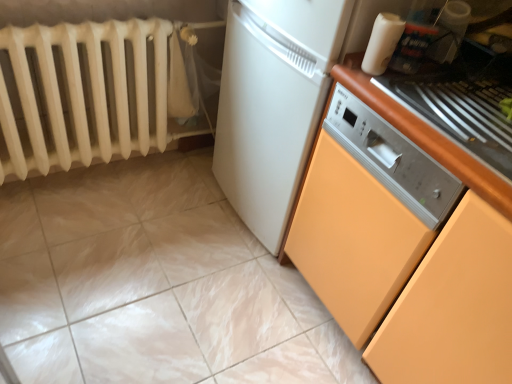
Question: Does white matte radiator at left have a lesser width compared to white glossy plastic container at upper right?

Choices:
 (A) yes
 (B) no

Answer: (B)

Question: Considering the relative positions of white matte radiator at left and white glossy plastic container at upper right in the image provided, is white matte radiator at left in front of white glossy plastic container at upper right?

Choices:
 (A) yes
 (B) no

Answer: (B)

Question: From a real-world perspective, is white matte radiator at left below white glossy plastic container at upper right?

Choices:
 (A) no
 (B) yes

Answer: (B)

Question: Is white matte radiator at left not close to white glossy plastic container at upper right?

Choices:
 (A) yes
 (B) no

Answer: (A)

Question: From a real-world perspective, does white matte radiator at left stand above white glossy plastic container at upper right?

Choices:
 (A) no
 (B) yes

Answer: (A)

Question: Does point (93, 352) appear closer or farther from the camera than point (388, 51)?

Choices:
 (A) closer
 (B) farther

Answer: (B)

Question: From the image's perspective, is white glossy tile at lower center located above or below white glossy plastic container at upper right?

Choices:
 (A) below
 (B) above

Answer: (A)

Question: Is white glossy tile at lower center taller or shorter than white glossy plastic container at upper right?

Choices:
 (A) short
 (B) tall

Answer: (A)

Question: Considering their positions, is white glossy tile at lower center located in front of or behind white glossy plastic container at upper right?

Choices:
 (A) behind
 (B) front

Answer: (B)

Question: Is white glossy plastic container at upper right wider or thinner than white glossy tile at lower center?

Choices:
 (A) wide
 (B) thin

Answer: (B)

Question: From a real-world perspective, is white glossy plastic container at upper right above or below white glossy tile at lower center?

Choices:
 (A) above
 (B) below

Answer: (A)

Question: In the image, is white glossy plastic container at upper right on the left side or the right side of white glossy tile at lower center?

Choices:
 (A) right
 (B) left

Answer: (A)

Question: Does point (401, 29) appear closer or farther from the camera than point (10, 226)?

Choices:
 (A) farther
 (B) closer

Answer: (B)

Question: Is white matte radiator at left wider or thinner than white glossy tile at lower center?

Choices:
 (A) thin
 (B) wide

Answer: (A)

Question: Which is correct: white matte radiator at left is inside white glossy tile at lower center, or outside of it?

Choices:
 (A) inside
 (B) outside

Answer: (B)